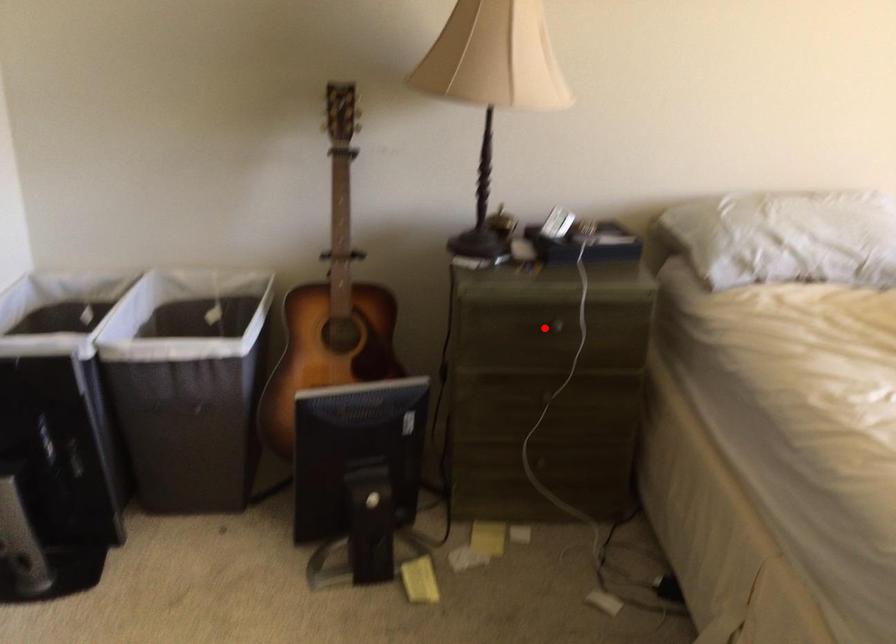
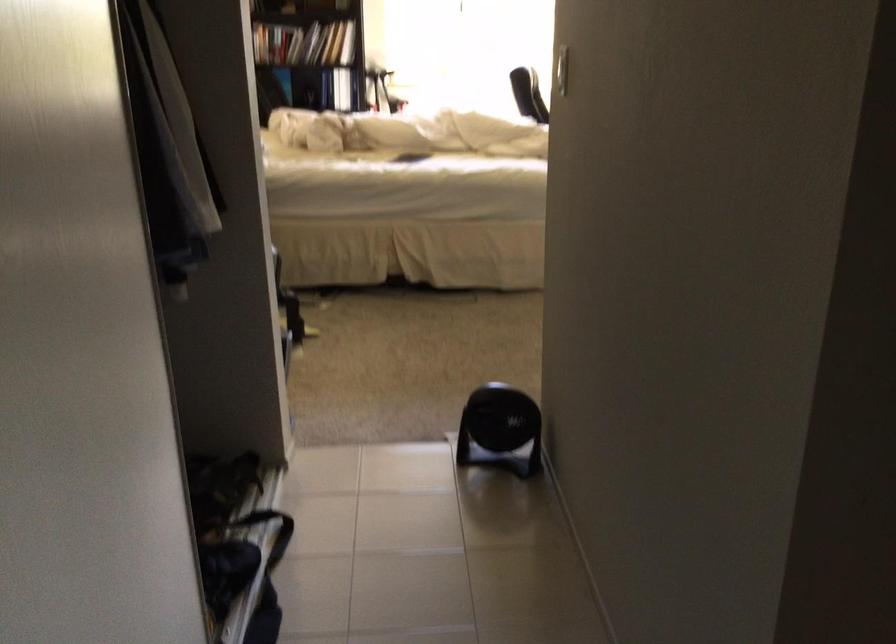
Question: I am providing you with two images of the same scene from different viewpoints. A red point is marked on the first image. Can you still see the location of the red point in image 2?

Choices:
 (A) Yes
 (B) No

Answer: (B)